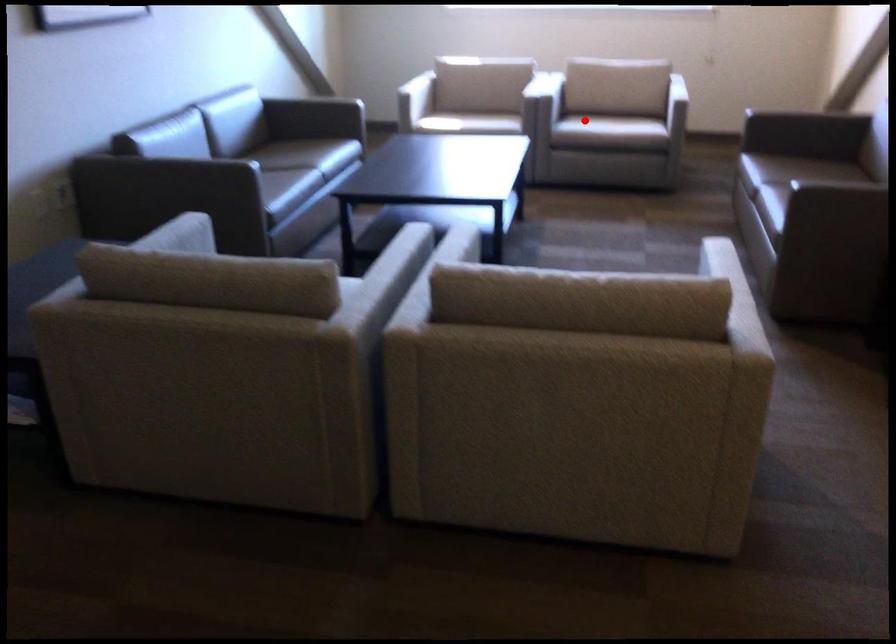
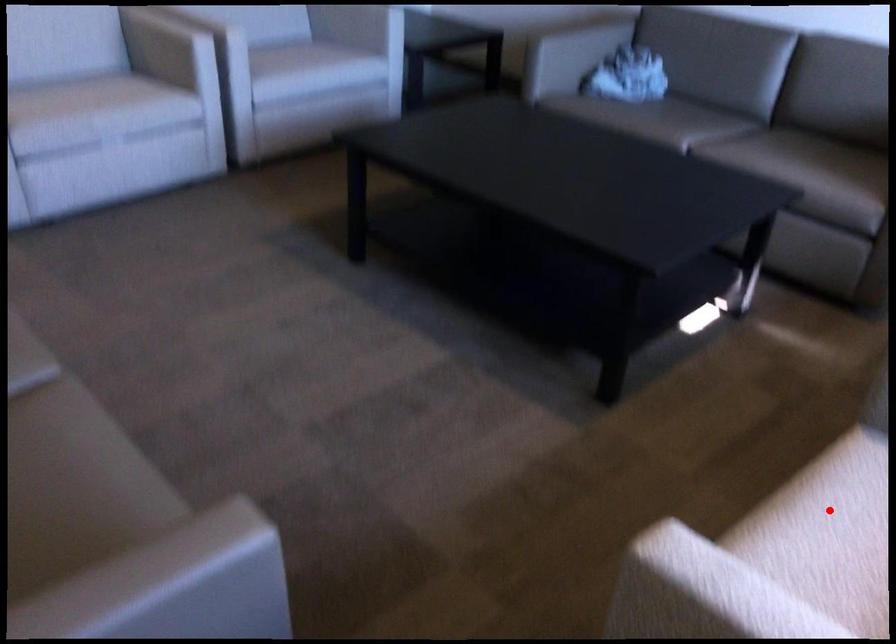
I am providing you with two images of the same scene from different viewpoints. A red point is marked on the first image and another point is marked on the second image. Does the point marked in image1 correspond to the same location as the one in image2?

Yes